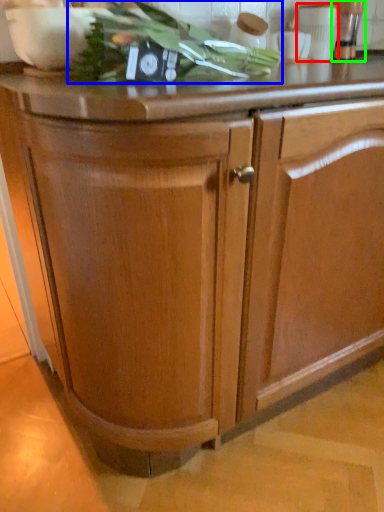
Question: Estimate the real-world distances between objects in this image. Which object is farther from appliance (highlighted by a red box), vegetable (highlighted by a blue box) or appliance (highlighted by a green box)?

Choices:
 (A) vegetable
 (B) appliance

Answer: (A)